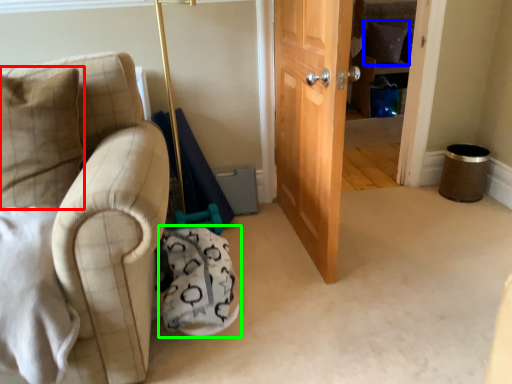
Question: Which is nearer to the pillow (highlighted by a red box)? pillow (highlighted by a blue box) or swivel chair (highlighted by a green box).

Choices:
 (A) pillow
 (B) swivel chair

Answer: (B)